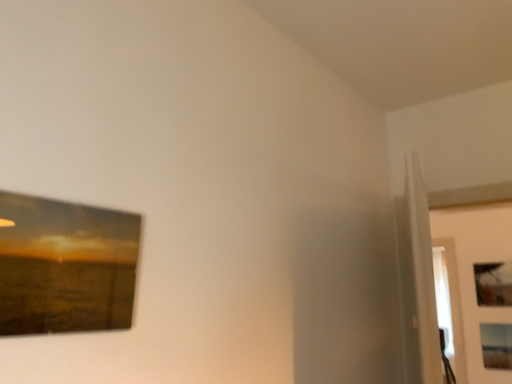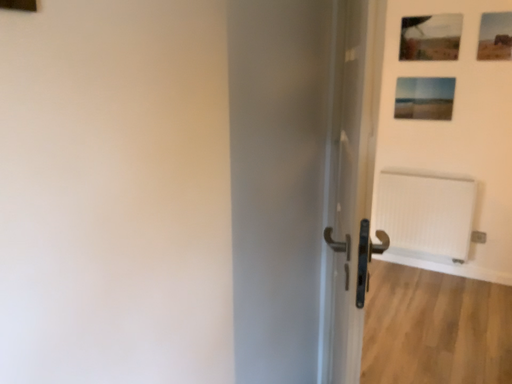
Question: How did the camera likely rotate when shooting the video?

Choices:
 (A) rotated left
 (B) rotated right

Answer: (B)